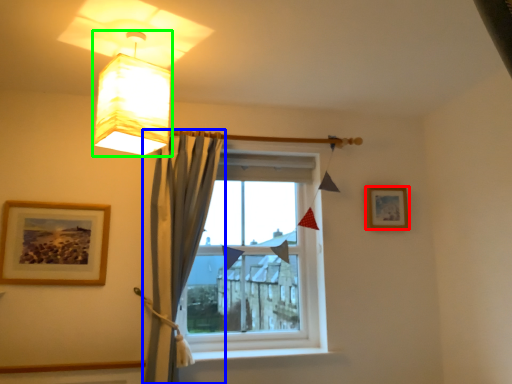
Question: Which object is the farthest from picture frame (highlighted by a red box)? Choose among these: curtain (highlighted by a blue box) or lamp (highlighted by a green box).

Choices:
 (A) curtain
 (B) lamp

Answer: (B)